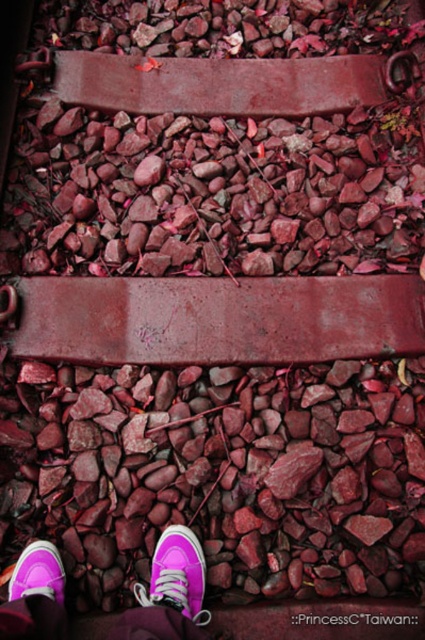
You are holding a camera and want to take a photo of the purple suede sneakers at lower left. If you are currently standing 4.15 feet away from the sneakers, is the distance sufficient to capture the entire pair of sneakers in the frame?

The purple suede sneakers at lower left and camera are 4.15 feet apart from each other. This distance is sufficient to capture the entire pair of sneakers in the frame as long as the camera has a wide enough lens or the photographer adjusts their position accordingly.

You are a photographer trying to capture both the purple suede sneakers at lower left and the purple suede shoe at lower left in the same frame. Which object is wider and will require more space in the composition?

The purple suede sneakers at lower left is wider than the purple suede shoe at lower left, so it requires more space in the composition.